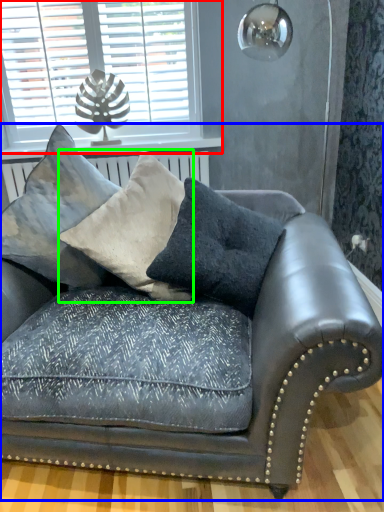
Question: Which object is positioned closest to window (highlighted by a red box)? Select from studio couch (highlighted by a blue box) and pillow (highlighted by a green box).

Choices:
 (A) studio couch
 (B) pillow

Answer: (B)